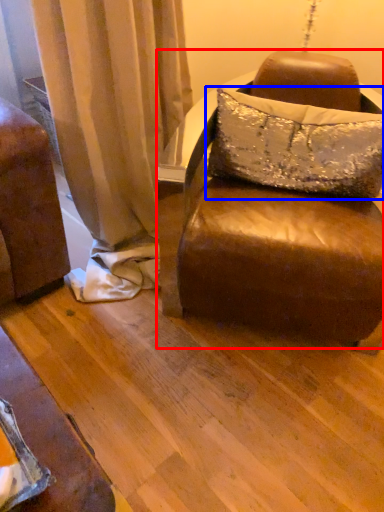
Question: Which object is closer to the camera taking this photo, studio couch (highlighted by a red box) or pillow (highlighted by a blue box)?

Choices:
 (A) studio couch
 (B) pillow

Answer: (A)